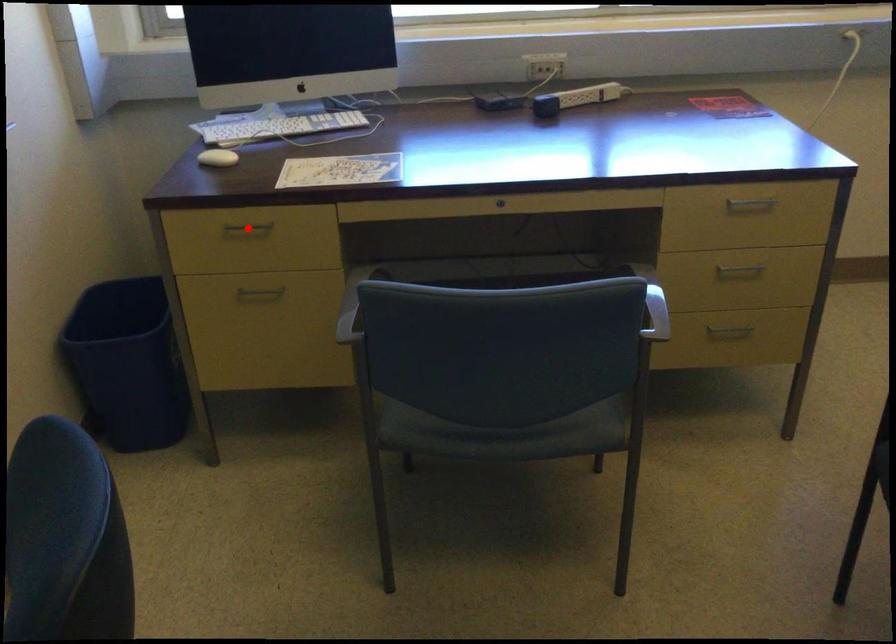
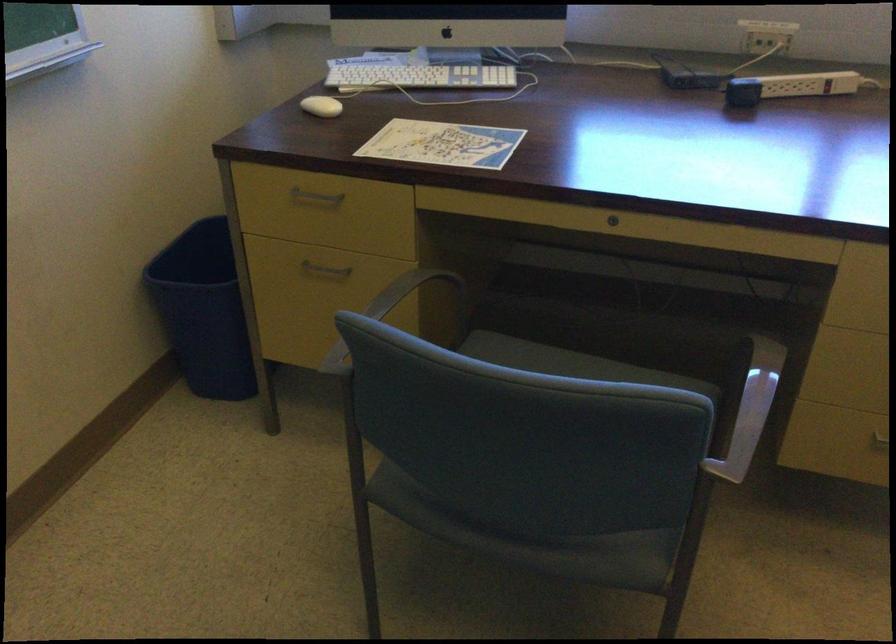
Locate, in the second image, the point that corresponds to the highlighted location in the first image.

(315, 196)